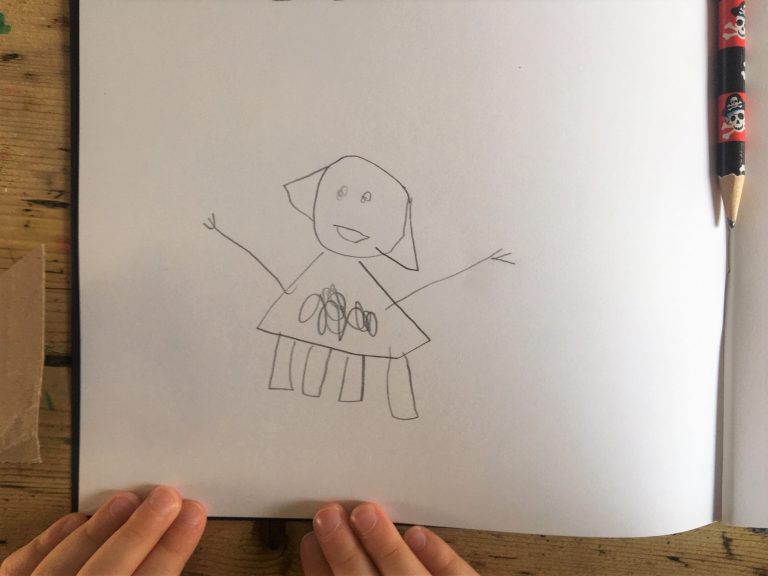
The image size is (768, 576). Identify the location of led. (727, 222).